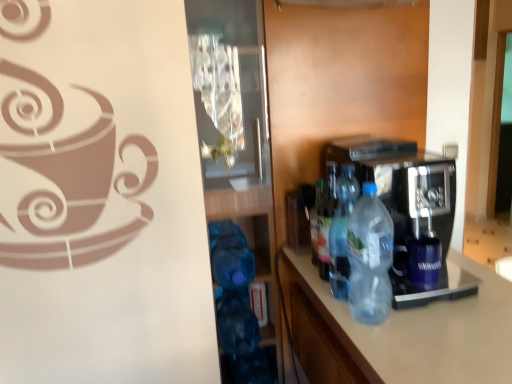
Question: In the image, is translucent plastic bottle at center, positioned as the 1th bottle in front-to-back order, positioned in front of or behind transparent glass door at center?

Choices:
 (A) front
 (B) behind

Answer: (A)

Question: From a real-world perspective, is translucent plastic bottle at center, which is the 3th bottle from back to front, above or below transparent glass door at center?

Choices:
 (A) below
 (B) above

Answer: (B)

Question: Based on their relative distances, which object is nearer to the translucent plastic bottle at center, placed as the first bottle when sorted from back to front?

Choices:
 (A) translucent plastic bottles at center, which is the 2th bottle from back to front
 (B) transparent plastic coffee machine at center
 (C) translucent plastic bottle at center, which is the 3th bottle from back to front
 (D) transparent glass door at center

Answer: (A)

Question: Which object is the closest to the translucent plastic bottles at center, which is the second bottle from front to back?

Choices:
 (A) translucent plastic bottle at center, the third bottle positioned from the front
 (B) transparent glass door at center
 (C) translucent plastic bottle at center, which is the 3th bottle from back to front
 (D) transparent plastic coffee machine at center

Answer: (A)